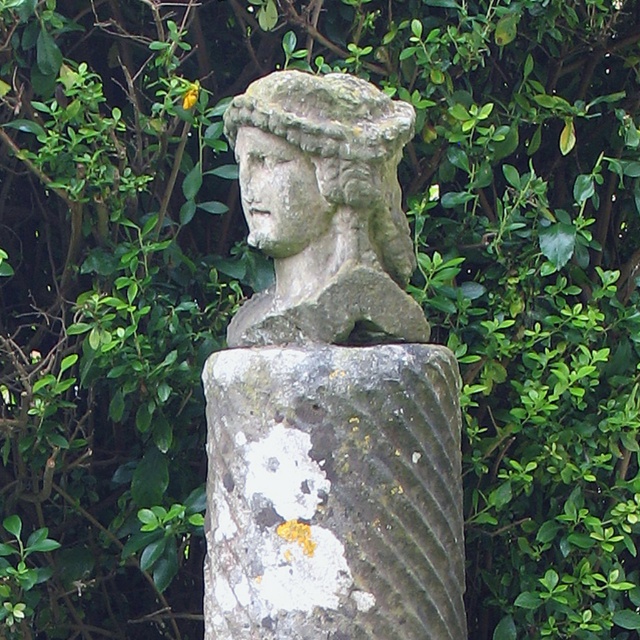
This screenshot has width=640, height=640. Describe the element at coordinates (333, 493) in the screenshot. I see `speckled stone column at center` at that location.

Does point (285, 513) lie in front of point (333, 200)?

Yes, it is in front of point (333, 200).

What are the coordinates of `speckled stone column at center` in the screenshot? It's located at (333, 493).

Which is behind, point (444, 513) or point (289, 532)?

The point (444, 513) is behind.

Does stone statue at center have a larger size compared to speckled stone column at center?

Yes.

Between point (296, 630) and point (241, 572), which one is positioned in front?

Point (296, 630)

At what (x,y) coordinates should I click in order to perform the action: click on stone statue at center. Please return your answer as a coordinate pair (x, y). The image size is (640, 640). Looking at the image, I should click on (330, 388).

Between stone statue at center and stone statue head at center, which one appears on the left side from the viewer's perspective?

From the viewer's perspective, stone statue head at center appears more on the left side.

Locate an element on the screen. stone statue at center is located at coordinates [330, 388].